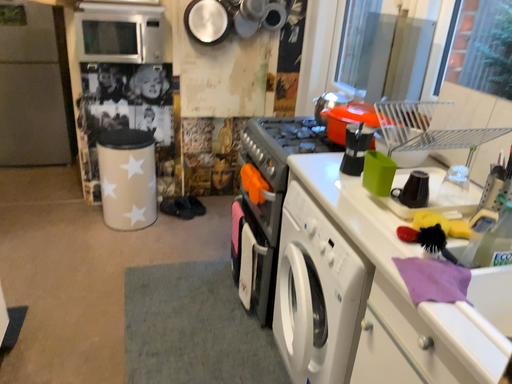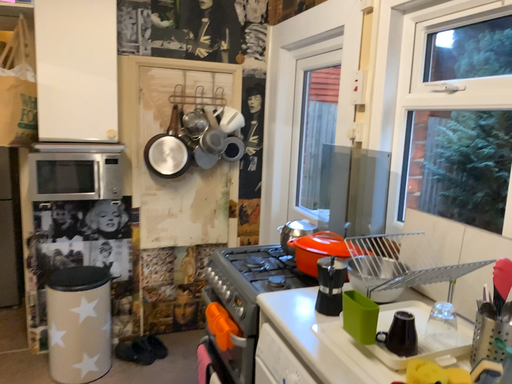
Question: How did the camera likely rotate when shooting the video?

Choices:
 (A) rotated upward
 (B) rotated downward

Answer: (A)